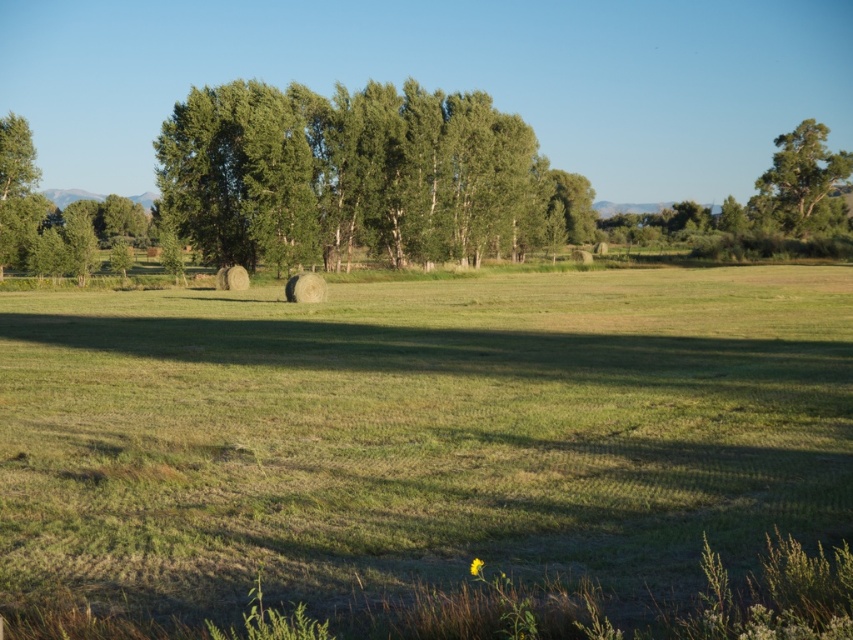
Question: Which point appears farthest from the camera in this image?

Choices:
 (A) (613, 576)
 (B) (788, 230)
 (C) (28, 195)

Answer: (B)

Question: Does green leafy trees at upper left have a larger size compared to green leafy tree at left?

Choices:
 (A) no
 (B) yes

Answer: (B)

Question: Does green grassy field at center have a larger size compared to green leafy tree at left?

Choices:
 (A) no
 (B) yes

Answer: (B)

Question: Does green leafy trees at upper left have a smaller size compared to green leafy tree at upper right?

Choices:
 (A) no
 (B) yes

Answer: (B)

Question: Which point appears closest to the camera in this image?

Choices:
 (A) (416, 125)
 (B) (782, 163)
 (C) (651, 332)
 (D) (28, 204)

Answer: (C)

Question: Which point is farther to the camera?

Choices:
 (A) green leafy tree at left
 (B) green grassy field at center
 (C) green leafy tree at upper right
 (D) green leafy trees at upper left

Answer: (C)